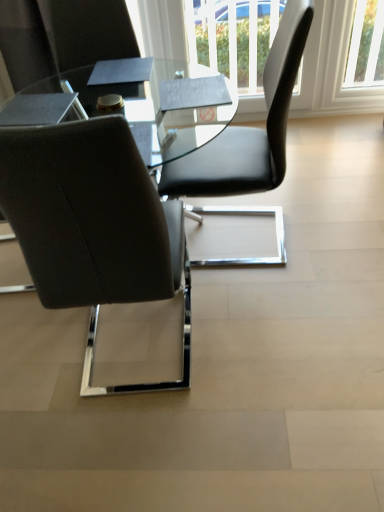
Locate an element on the screen. Image resolution: width=384 pixels, height=512 pixels. vacant area to the right of transparent glass table at center is located at coordinates (314, 248).